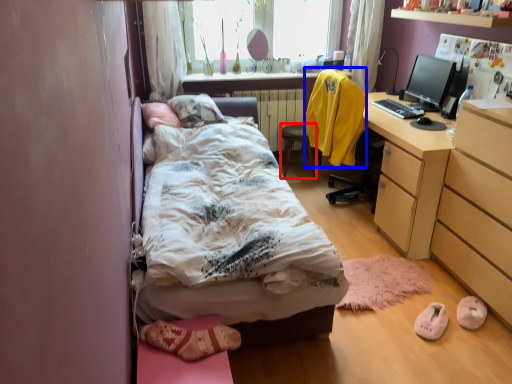
Question: Which point is closer to the camera, chair (highlighted by a red box) or sweatshirt (highlighted by a blue box)?

Choices:
 (A) chair
 (B) sweatshirt

Answer: (B)